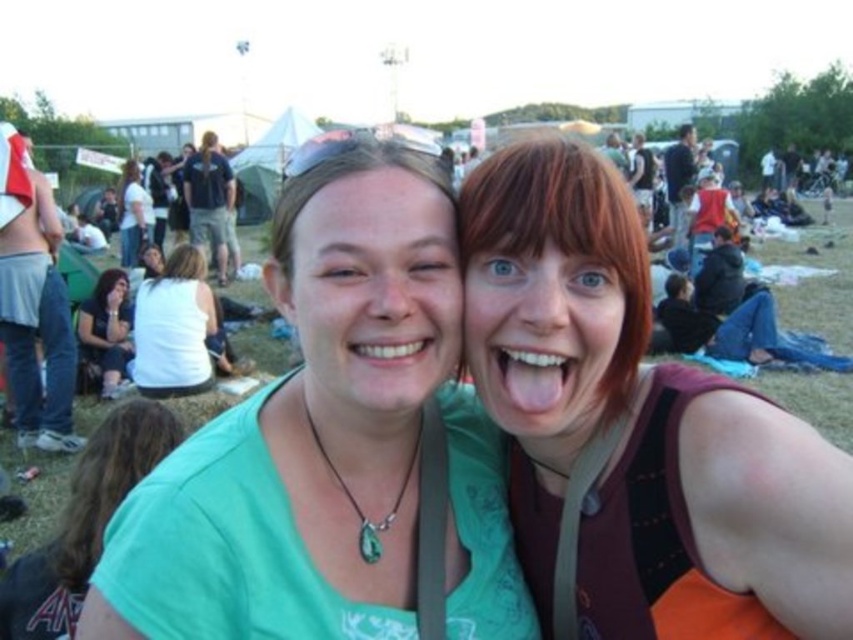
Question: Considering the real-world distances, which object is farthest from the matte white shirt at center?

Choices:
 (A) green matte shirt at center
 (B) matte orange tank top at right
 (C) white cotton shirt at center

Answer: (B)

Question: Is green fabric shirt at lower left below matte white shirt at center?

Choices:
 (A) no
 (B) yes

Answer: (B)

Question: Does green matte shirt at center appear under green fabric shirt at lower left?

Choices:
 (A) yes
 (B) no

Answer: (B)

Question: Which point is closer to the camera?

Choices:
 (A) (178, 273)
 (B) (844, 545)
 (C) (112, 307)

Answer: (B)

Question: Which of the following is the closest to the observer?

Choices:
 (A) green fabric shirt at lower left
 (B) green matte shirt at center

Answer: (B)

Question: Is the position of green fabric shirt at lower left less distant than that of matte white shirt at lower left?

Choices:
 (A) no
 (B) yes

Answer: (B)